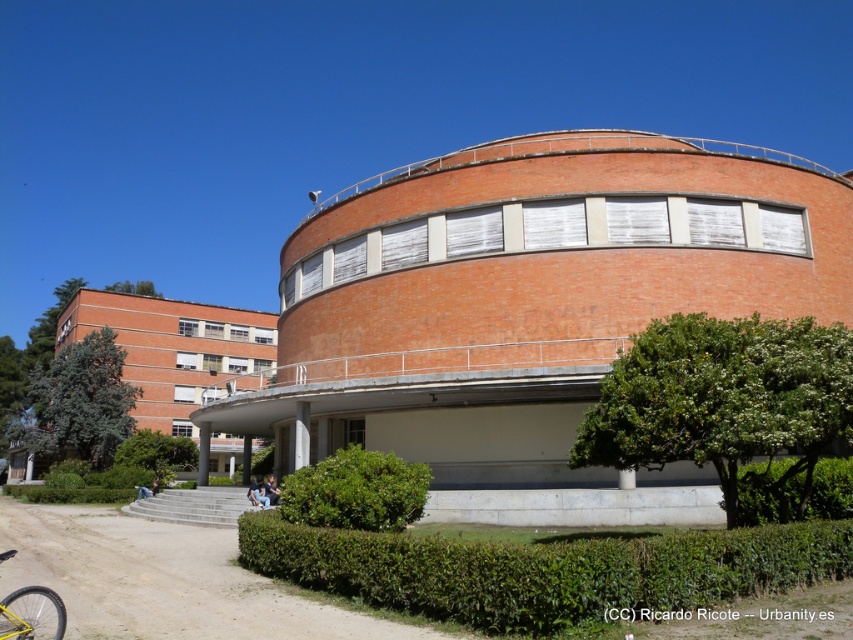
Question: Is brown dirt track at lower left in front of light blue jeans at lower center?

Choices:
 (A) yes
 (B) no

Answer: (A)

Question: Which point is closer to the camera?

Choices:
 (A) light blue jeans at lower center
 (B) green leafy bush at lower center

Answer: (B)

Question: Which object is positioned closest to the green leafy hedge at lower left?

Choices:
 (A) brown dirt track at lower left
 (B) green leafy hedge at lower center
 (C) green leafy bush at lower center

Answer: (A)

Question: Does green leafy hedge at lower right lie in front of green leafy hedge at lower left?

Choices:
 (A) no
 (B) yes

Answer: (B)

Question: Which object is positioned closest to the green leafy bush at lower center?

Choices:
 (A) green leafy hedge at lower right
 (B) brown dirt track at lower left

Answer: (B)

Question: Can you confirm if green leafy hedge at lower center is bigger than green leafy hedge at lower right?

Choices:
 (A) yes
 (B) no

Answer: (A)